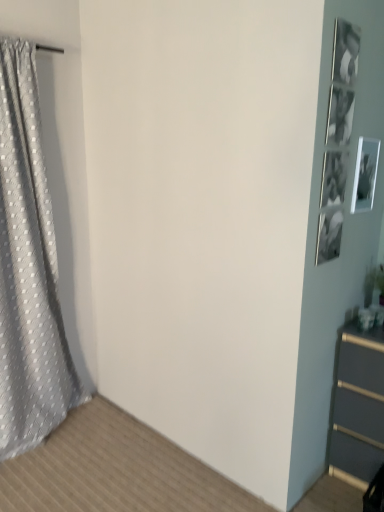
In order to face white glossy picture frame at upper right, should I rotate leftwards or rightwards?

To face it directly, rotate right by 22.145 degrees.

What do you see at coordinates (365, 175) in the screenshot?
I see `white glossy picture frame at upper right` at bounding box center [365, 175].

Where is `white glossy picture frame at upper right`? white glossy picture frame at upper right is located at coordinates (365, 175).

At what (x,y) coordinates should I click in order to perform the action: click on gray textured curtain at left. Please return your answer as a coordinate pair (x, y). Looking at the image, I should click on (28, 270).

The image size is (384, 512). Describe the element at coordinates (28, 270) in the screenshot. I see `gray textured curtain at left` at that location.

Locate an element on the screen. This screenshot has width=384, height=512. white glossy picture frame at upper right is located at coordinates (365, 175).

Consider the image. Is gray textured curtain at left to the left of white glossy picture frame at upper right from the viewer's perspective?

Yes, gray textured curtain at left is to the left of white glossy picture frame at upper right.

Consider the image. Which object is further away from the camera, gray textured curtain at left or white glossy picture frame at upper right?

Positioned behind is white glossy picture frame at upper right.

Does point (16, 342) lie in front of point (358, 185)?

That is False.

From the image's perspective, does gray textured curtain at left appear lower than white glossy picture frame at upper right?

Yes, from the image's perspective, gray textured curtain at left is beneath white glossy picture frame at upper right.

From a real-world perspective, is gray textured curtain at left above or below white glossy picture frame at upper right?

Clearly, from a real-world perspective, gray textured curtain at left is below white glossy picture frame at upper right.

In terms of width, does gray textured curtain at left look wider or thinner when compared to white glossy picture frame at upper right?

Clearly, gray textured curtain at left has more width compared to white glossy picture frame at upper right.

Considering the sizes of objects gray textured curtain at left and white glossy picture frame at upper right in the image provided, who is taller, gray textured curtain at left or white glossy picture frame at upper right?

With more height is gray textured curtain at left.

Which of these two, gray textured curtain at left or white glossy picture frame at upper right, is bigger?

With larger size is gray textured curtain at left.

Consider the image. Would you say white glossy picture frame at upper right is part of gray textured curtain at left's contents?

That's incorrect, white glossy picture frame at upper right is not inside gray textured curtain at left.

Consider the image. Is gray textured curtain at left directly adjacent to white glossy picture frame at upper right?

gray textured curtain at left and white glossy picture frame at upper right are clearly separated.

From the picture: Is gray textured curtain at left facing away from white glossy picture frame at upper right?

gray textured curtain at left is not turned away from white glossy picture frame at upper right.

What's the angular difference between gray textured curtain at left and white glossy picture frame at upper right's facing directions?

gray textured curtain at left and white glossy picture frame at upper right are facing 1.41 degrees away from each other.

Measure the distance between gray textured curtain at left and white glossy picture frame at upper right.

gray textured curtain at left is 1.55 meters from white glossy picture frame at upper right.

At what (x,y) coordinates should I click in order to perform the action: click on curtain in front of the white glossy picture frame at upper right. Please return your answer as a coordinate pair (x, y). The height and width of the screenshot is (512, 384). Looking at the image, I should click on (28, 270).

Can you confirm if white glossy picture frame at upper right is positioned to the right of gray textured curtain at left?

Correct, you'll find white glossy picture frame at upper right to the right of gray textured curtain at left.

Which object is further away from the camera taking this photo, white glossy picture frame at upper right or gray textured curtain at left?

white glossy picture frame at upper right is behind.

Is point (352, 196) less distant than point (36, 129)?

That is True.

From the image's perspective, which object appears higher, white glossy picture frame at upper right or gray textured curtain at left?

white glossy picture frame at upper right is shown above in the image.

From a real-world perspective, relative to gray textured curtain at left, is white glossy picture frame at upper right vertically above or below?

From a real-world perspective, white glossy picture frame at upper right is physically above gray textured curtain at left.

Considering the sizes of objects white glossy picture frame at upper right and gray textured curtain at left in the image provided, who is thinner, white glossy picture frame at upper right or gray textured curtain at left?

Thinner between the two is white glossy picture frame at upper right.

Does white glossy picture frame at upper right have a greater height compared to gray textured curtain at left?

In fact, white glossy picture frame at upper right may be shorter than gray textured curtain at left.

Considering the sizes of white glossy picture frame at upper right and gray textured curtain at left in the image, is white glossy picture frame at upper right bigger or smaller than gray textured curtain at left?

Considering their sizes, white glossy picture frame at upper right takes up less space than gray textured curtain at left.

Can gray textured curtain at left be found inside white glossy picture frame at upper right?

That's incorrect, gray textured curtain at left is not inside white glossy picture frame at upper right.

Is white glossy picture frame at upper right beside gray textured curtain at left?

white glossy picture frame at upper right and gray textured curtain at left are not in contact.

Could you tell me if white glossy picture frame at upper right is turned towards gray textured curtain at left?

No, white glossy picture frame at upper right does not turn towards gray textured curtain at left.

Where is `curtain in front of the white glossy picture frame at upper right`? The height and width of the screenshot is (512, 384). curtain in front of the white glossy picture frame at upper right is located at coordinates (28, 270).

Where is `curtain below the white glossy picture frame at upper right (from a real-world perspective)`? The image size is (384, 512). curtain below the white glossy picture frame at upper right (from a real-world perspective) is located at coordinates (28, 270).

Where is `curtain on the left of white glossy picture frame at upper right`? The image size is (384, 512). curtain on the left of white glossy picture frame at upper right is located at coordinates (28, 270).